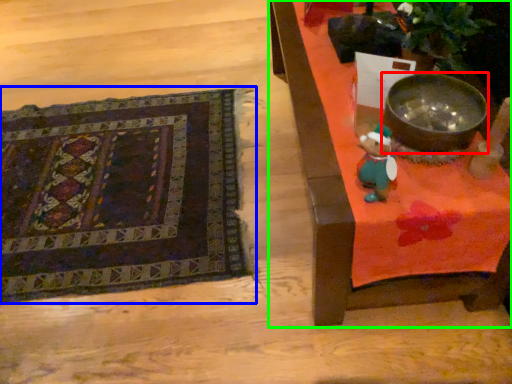
Question: Based on their relative distances, which object is farther from mixing bowl (highlighted by a red box)? Choose from mat (highlighted by a blue box) and furniture (highlighted by a green box).

Choices:
 (A) mat
 (B) furniture

Answer: (A)